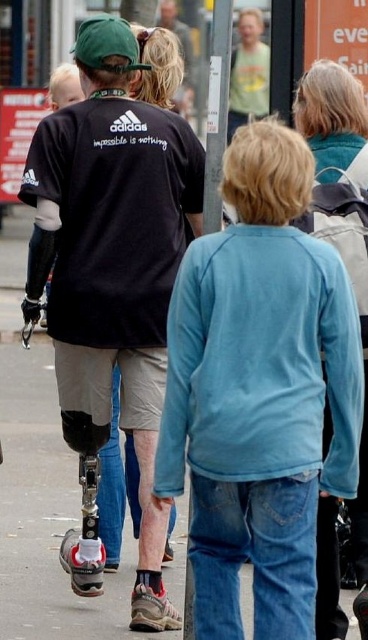
Between point (175, 376) and point (231, 99), which one is positioned in front?

Point (175, 376) is more forward.

Who is taller, matte blue sweatshirt at center or green cotton shirt at upper center?

green cotton shirt at upper center

Which is behind, point (305, 588) or point (228, 115)?

The point (228, 115) is behind.

Where is `matte blue sweatshirt at center`? matte blue sweatshirt at center is located at coordinates (260, 390).

Between matte black t-shirt at center and green cotton shirt at upper center, which one has less height?

matte black t-shirt at center is shorter.

Between point (82, 432) and point (253, 96), which one is positioned behind?

Point (253, 96)

Is point (139, 147) closer to camera compared to point (249, 92)?

Yes, it is.

This screenshot has height=640, width=368. Find the location of `matte black t-shirt at center`. matte black t-shirt at center is located at coordinates (112, 264).

Does matte blue sweatshirt at center appear on the left side of matte black t-shirt at center?

No, matte blue sweatshirt at center is not to the left of matte black t-shirt at center.

What do you see at coordinates (260, 390) in the screenshot? I see `matte blue sweatshirt at center` at bounding box center [260, 390].

Which is in front, point (186, 420) or point (138, 349)?

Point (186, 420) is in front.

Find the location of a particular element. This screenshot has width=368, height=640. matte blue sweatshirt at center is located at coordinates (260, 390).